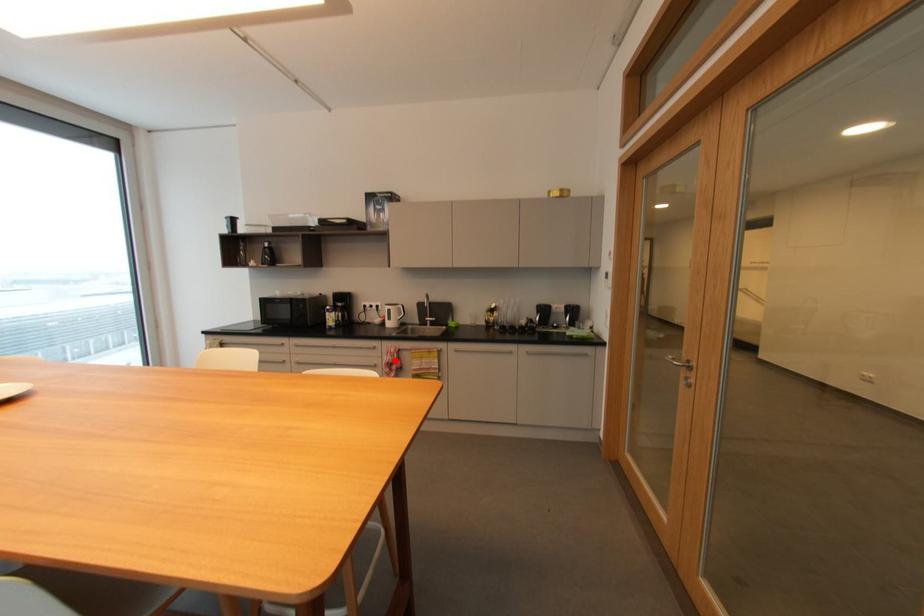
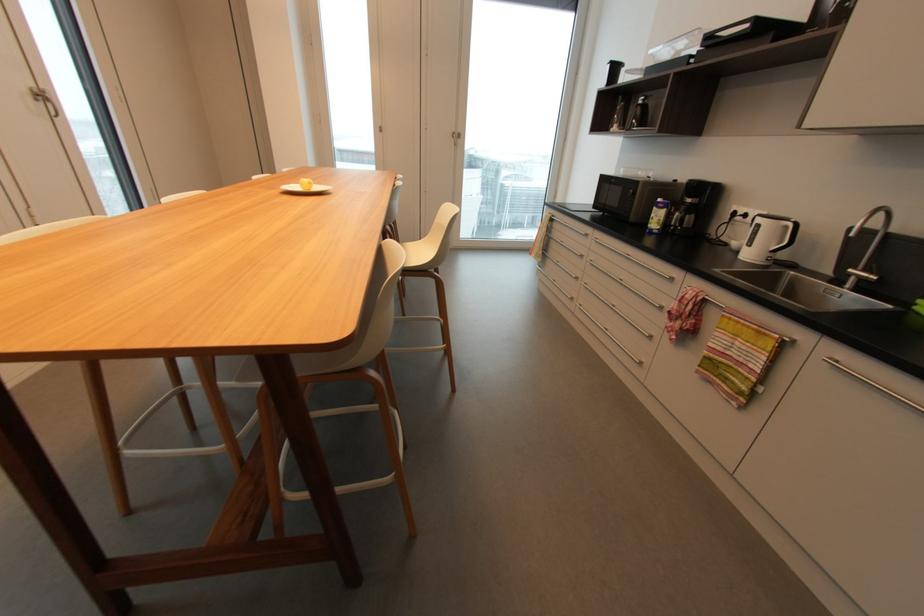
Question: I am providing you with two images of the same scene from different viewpoints. A red point is shown in image1. For the corresponding object point in image2, is it positioned nearer or farther from the camera?

Choices:
 (A) Nearer
 (B) Farther

Answer: (A)